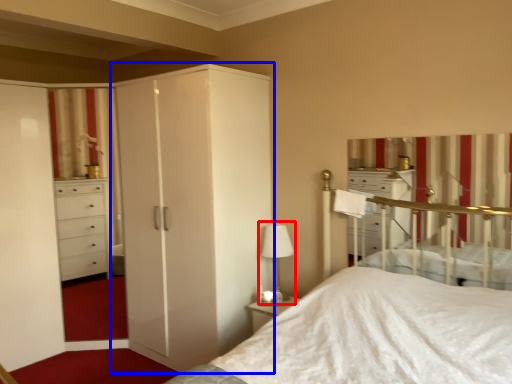
Question: Which of the following is the closest to the observer, table lamp (highlighted by a red box) or cupboard (highlighted by a blue box)?

Choices:
 (A) table lamp
 (B) cupboard

Answer: (B)